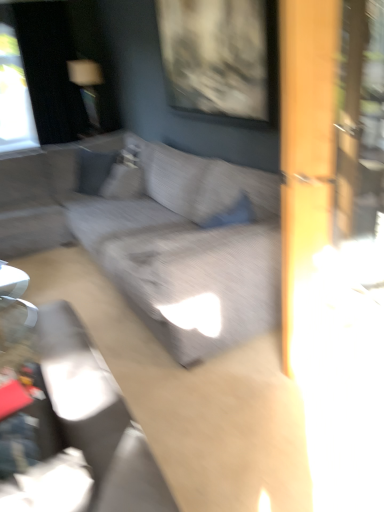
Question: From the image's perspective, is suede-like gray pillow at upper left located above or below textured gray couch at center?

Choices:
 (A) above
 (B) below

Answer: (A)

Question: Based on their sizes in the image, would you say suede-like gray pillow at upper left is bigger or smaller than textured gray couch at center?

Choices:
 (A) small
 (B) big

Answer: (A)

Question: Considering the real-world distances, which object is closest to the suede-like gray pillow at upper left?

Choices:
 (A) textured gray couch at center
 (B) matte gray swivel chair at center

Answer: (A)

Question: Which object is the closest to the matte gray swivel chair at center?

Choices:
 (A) textured gray couch at center
 (B) suede-like gray pillow at upper left

Answer: (A)